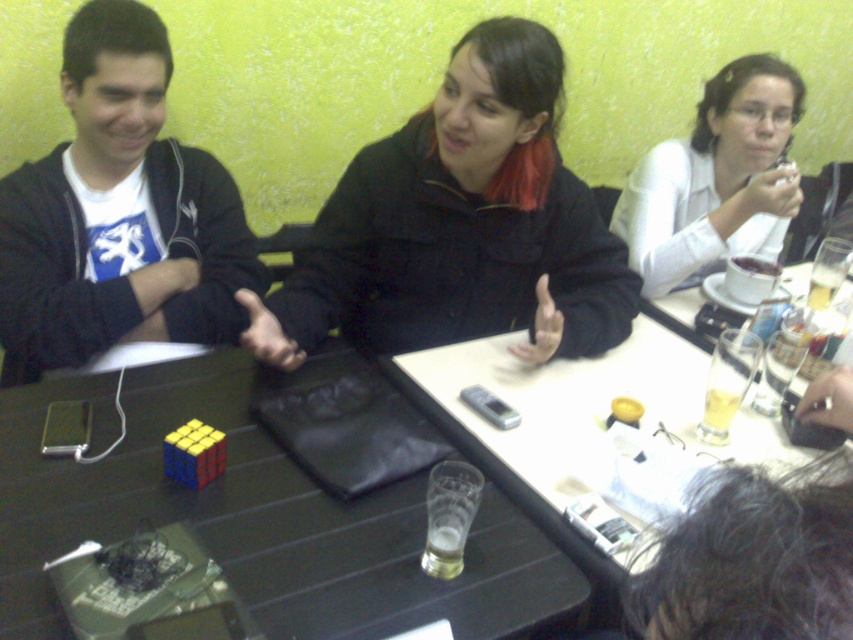
Who is taller, black matte jacket at left or translucent glass beer at table center?

Standing taller between the two is black matte jacket at left.

Is point (97, 342) farther from viewer compared to point (460, 531)?

Yes, point (97, 342) is behind point (460, 531).

Is point (141, 10) behind point (428, 524)?

That is True.

The image size is (853, 640). Find the location of `black matte jacket at left`. black matte jacket at left is located at coordinates (119, 214).

Who is higher up, translucent glass at center or translucent glass at table right?

Positioned higher is translucent glass at center.

Between translucent glass at center and translucent glass at table right, which one is positioned lower?

translucent glass at table right

Who is more distant from viewer, (575, 410) or (717, 422)?

Point (575, 410)

Locate an element on the screen. The image size is (853, 640). translucent glass at center is located at coordinates (573, 419).

Is black matte jacket at center to the left of translucent glass at center from the viewer's perspective?

Correct, you'll find black matte jacket at center to the left of translucent glass at center.

Between black matte jacket at center and translucent glass at center, which one is positioned lower?

translucent glass at center is below.

Who is more distant from viewer, (425, 211) or (693, 396)?

The point (425, 211) is more distant.

Locate an element on the screen. The width and height of the screenshot is (853, 640). black matte jacket at center is located at coordinates (460, 225).